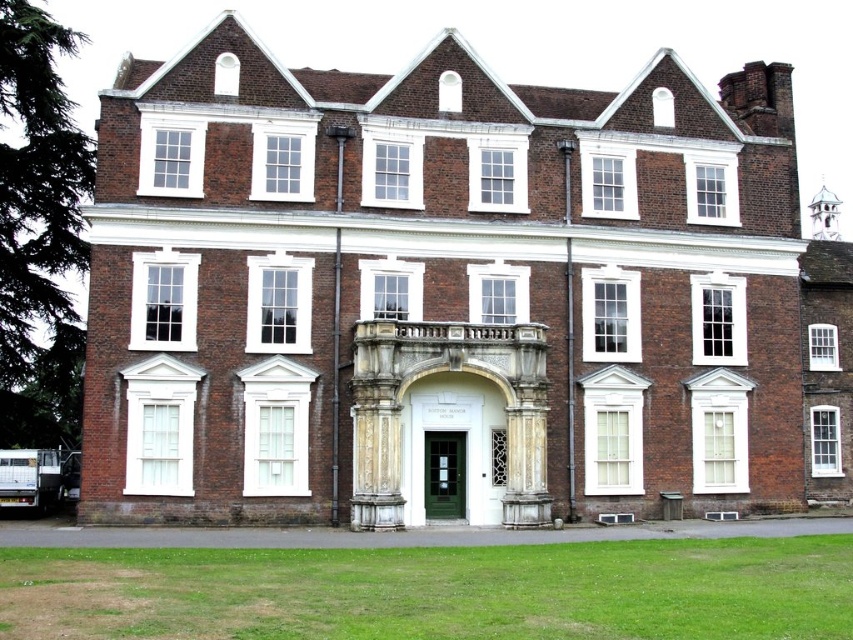
You are standing in front of the historic brick building and want to take a photo. You notice two points marked on the building. The first point is at coordinates point (633, 314), and the second point is at coordinates point (374, 588). Which of these points is closer to your camera when taking the photo?

Point (374, 588) is closer to the camera because it is not as far as point (633, 314), which is further away.